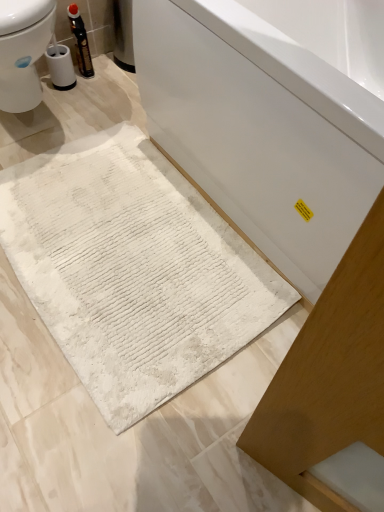
Question: Are white glossy bathtub at center and white textured bath mat at lower center beside each other?

Choices:
 (A) yes
 (B) no

Answer: (B)

Question: Does white glossy bathtub at center appear on the left side of white textured bath mat at lower center?

Choices:
 (A) no
 (B) yes

Answer: (A)

Question: Does white glossy bathtub at center come behind white textured bath mat at lower center?

Choices:
 (A) no
 (B) yes

Answer: (A)

Question: From the image's perspective, does white glossy bathtub at center appear lower than white textured bath mat at lower center?

Choices:
 (A) yes
 (B) no

Answer: (B)

Question: Is white glossy bathtub at center completely or partially outside of white textured bath mat at lower center?

Choices:
 (A) no
 (B) yes

Answer: (B)

Question: Is white glossy bathtub at center at the right side of white textured bath mat at lower center?

Choices:
 (A) no
 (B) yes

Answer: (B)

Question: Considering the relative sizes of matte black bottle at upper left and white textured bath mat at lower center in the image provided, is matte black bottle at upper left thinner than white textured bath mat at lower center?

Choices:
 (A) yes
 (B) no

Answer: (A)

Question: Is matte black bottle at upper left wider than white textured bath mat at lower center?

Choices:
 (A) yes
 (B) no

Answer: (B)

Question: From the image's perspective, is matte black bottle at upper left beneath white textured bath mat at lower center?

Choices:
 (A) no
 (B) yes

Answer: (A)

Question: Is matte black bottle at upper left further to the viewer compared to white textured bath mat at lower center?

Choices:
 (A) yes
 (B) no

Answer: (A)

Question: Does matte black bottle at upper left have a greater height compared to white textured bath mat at lower center?

Choices:
 (A) yes
 (B) no

Answer: (A)

Question: Does matte black bottle at upper left have a larger size compared to white textured bath mat at lower center?

Choices:
 (A) no
 (B) yes

Answer: (A)

Question: Is white textured bath mat at lower center oriented away from white glossy bathtub at center?

Choices:
 (A) no
 (B) yes

Answer: (B)